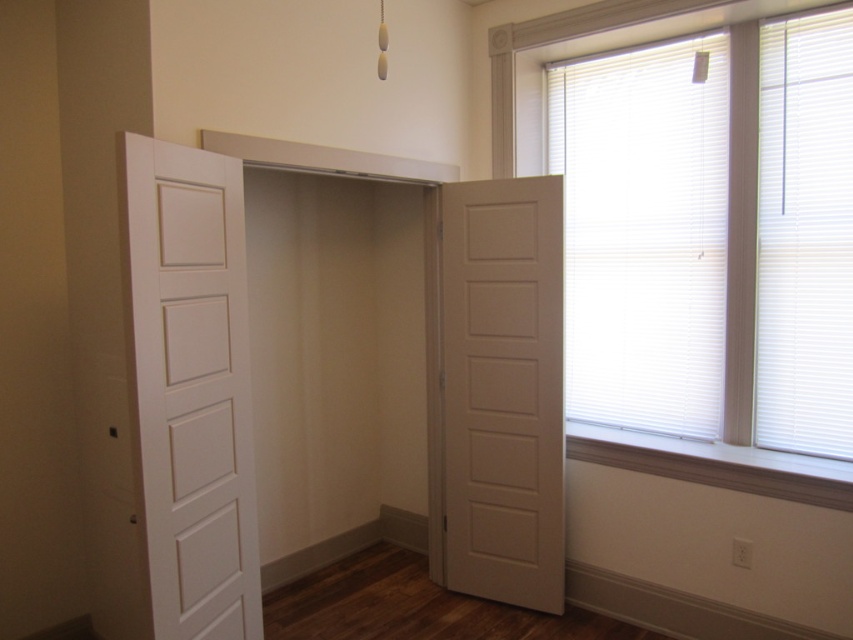
You are standing in the room and want to exit through the door. Where should you walk to reach the white matte door at left?

You should walk towards the left side of the room to reach the white matte door at left.

You are a delivery person entering the house and see the white matte door at right and the white blinds at upper right. Which object is located lower in the room?

The white matte door at right is positioned under the white blinds at upper right, so the white matte door at right is located lower in the room.

You are standing in the room and want to move from the point at coordinates point (236,161) to the point at coordinates point (492,272). Which direction should you move to get closer to your destination?

To move from point (236,161) to point (492,272), you should move towards the direction of the open door leading into the closet or hallway since point (492,272) is behind point (236,161).